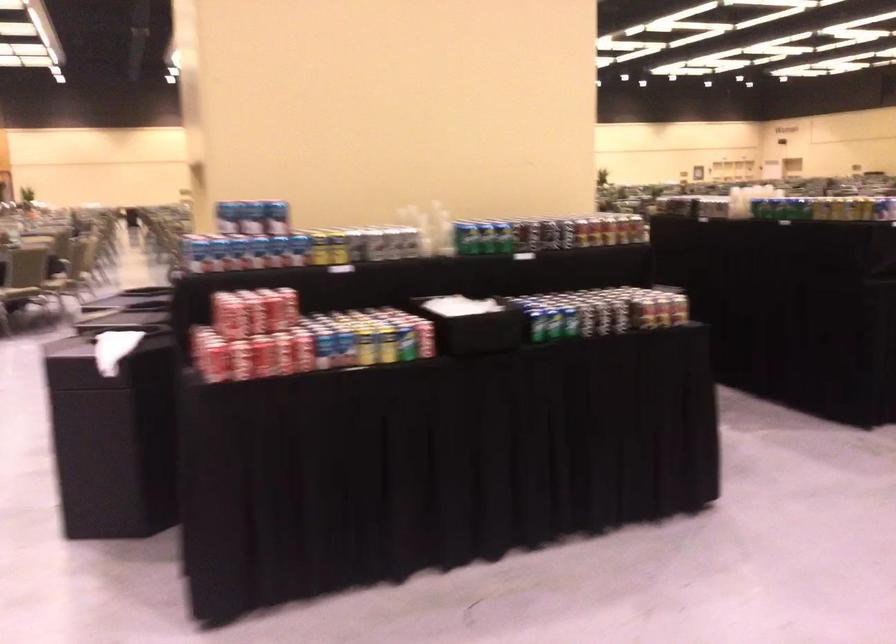
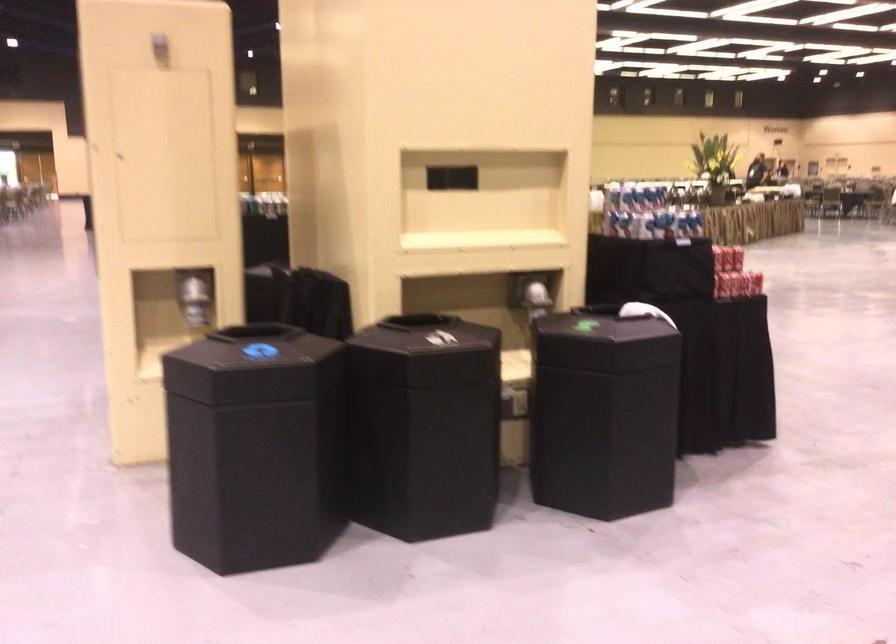
Question: I am providing you with two images of the same scene from different viewpoints. After the viewpoint changes to image2, which objects are now occluded?

Choices:
 (A) shiny dispenser lever
 (B) silver soda can
 (C) white woven basket
 (D) black bin lid

Answer: (B)